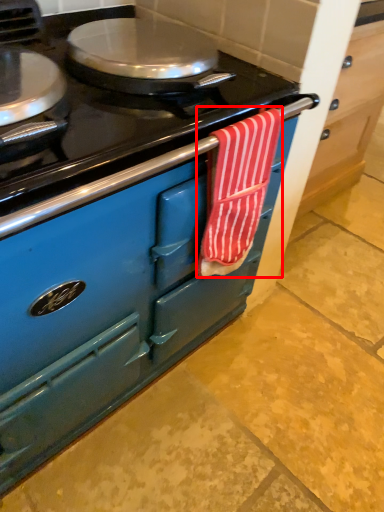
Question: Where is beach towel (annotated by the red box) located in relation to cabinetry in the image?

Choices:
 (A) left
 (B) right

Answer: (A)